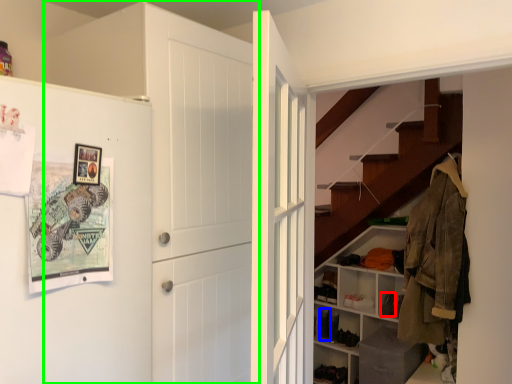
Question: Which object is positioned farthest from shoe (highlighted by a red box)? Select from shoe (highlighted by a blue box) and door (highlighted by a green box).

Choices:
 (A) shoe
 (B) door

Answer: (B)